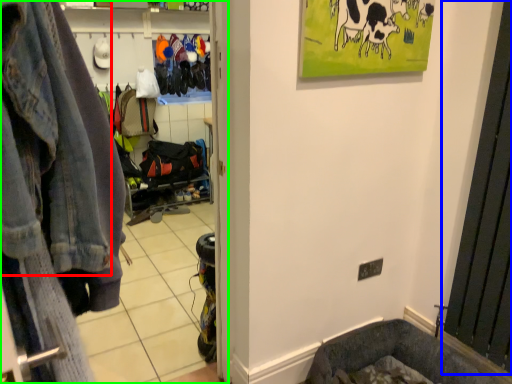
Question: Estimate the real-world distances between objects in this image. Which object is farther from denim jacket (highlighted by a red box), screen door (highlighted by a blue box) or clothing store (highlighted by a green box)?

Choices:
 (A) screen door
 (B) clothing store

Answer: (A)